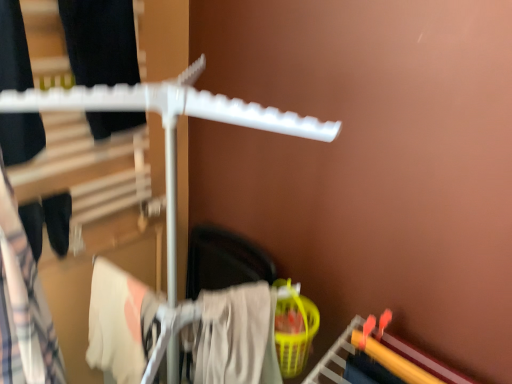
You are a GUI agent. You are given a task and a screenshot of the screen. Output one action in this format:
    pyautogui.click(x=<x>, y=<y>)
    Task: Click on the matte black pants at left, which ranks as the first clothing in left-to-right order
    The height and width of the screenshot is (384, 512).
    Given the screenshot: What is the action you would take?
    pyautogui.click(x=23, y=305)

Which object is further away from the camera taking this photo, white cotton towel at lower left, arranged as the second clothing when viewed from the left, or matte black pants at left, which ranks as the first clothing in left-to-right order?

white cotton towel at lower left, arranged as the second clothing when viewed from the left, is more distant.

Is point (90, 347) farther from camera compared to point (19, 279)?

Yes, it is.

In terms of height, does white cotton towel at lower left, arranged as the second clothing when viewed from the left, look taller or shorter compared to matte black pants at left, which ranks as the first clothing in left-to-right order?

white cotton towel at lower left, arranged as the second clothing when viewed from the left, is shorter than matte black pants at left, which ranks as the first clothing in left-to-right order.

Measure the distance from white cotton towel at lower left, which appears as the 2th clothing when viewed from the right, to matte black pants at left, which ranks as the first clothing in left-to-right order.

white cotton towel at lower left, which appears as the 2th clothing when viewed from the right, is 8.90 inches away from matte black pants at left, which ranks as the first clothing in left-to-right order.

How different are the orientations of beige cotton towel at lower center, placed as the third clothing when sorted from left to right, and matte black pants at left, which ranks as the first clothing in left-to-right order, in degrees?

There is a 1.28-degree angle between the facing directions of beige cotton towel at lower center, placed as the third clothing when sorted from left to right, and matte black pants at left, which ranks as the first clothing in left-to-right order.

Is beige cotton towel at lower center, the 1th clothing viewed from the right, far away from matte black pants at left, which ranks as the first clothing in left-to-right order?

No, beige cotton towel at lower center, the 1th clothing viewed from the right, is in close proximity to matte black pants at left, which ranks as the first clothing in left-to-right order.

From a real-world perspective, who is located lower, beige cotton towel at lower center, placed as the third clothing when sorted from left to right, or matte black pants at left, which ranks as the first clothing in left-to-right order?

beige cotton towel at lower center, placed as the third clothing when sorted from left to right.

Does beige cotton towel at lower center, the 1th clothing viewed from the right, have a larger size compared to matte black pants at left, which ranks as the first clothing in left-to-right order?

Indeed, beige cotton towel at lower center, the 1th clothing viewed from the right, has a larger size compared to matte black pants at left, which ranks as the first clothing in left-to-right order.

Considering the relative sizes of beige cotton towel at lower center, the 1th clothing viewed from the right, and white cotton towel at lower left, arranged as the second clothing when viewed from the left, in the image provided, is beige cotton towel at lower center, the 1th clothing viewed from the right, shorter than white cotton towel at lower left, arranged as the second clothing when viewed from the left,?

Result: Incorrect, the height of beige cotton towel at lower center, the 1th clothing viewed from the right, does not fall short of that of white cotton towel at lower left, arranged as the second clothing when viewed from the left.

Would you consider beige cotton towel at lower center, the 1th clothing viewed from the right, to be distant from white cotton towel at lower left, arranged as the second clothing when viewed from the left?

No.

From a real-world perspective, is beige cotton towel at lower center, placed as the third clothing when sorted from left to right, physically located above or below white cotton towel at lower left, which appears as the 2th clothing when viewed from the right?

In terms of real-world spatial position, beige cotton towel at lower center, placed as the third clothing when sorted from left to right, is below white cotton towel at lower left, which appears as the 2th clothing when viewed from the right.

Is point (233, 337) closer to viewer compared to point (143, 303)?

No, it is not.

Looking at this image, how different are the orientations of matte black pants at left, which ranks as the first clothing in left-to-right order, and beige cotton towel at lower center, placed as the third clothing when sorted from left to right, in degrees?

matte black pants at left, which ranks as the first clothing in left-to-right order, and beige cotton towel at lower center, placed as the third clothing when sorted from left to right, are facing 1.28 degrees away from each other.

From a real-world perspective, does matte black pants at left, which ranks as the first clothing in left-to-right order, stand above beige cotton towel at lower center, the 1th clothing viewed from the right?

Yes, from a real-world perspective, matte black pants at left, which ranks as the first clothing in left-to-right order, is over beige cotton towel at lower center, the 1th clothing viewed from the right

Could you measure the distance between matte black pants at left, arranged as the 3th clothing when viewed from the right, and beige cotton towel at lower center, the 1th clothing viewed from the right?

The distance of matte black pants at left, arranged as the 3th clothing when viewed from the right, from beige cotton towel at lower center, the 1th clothing viewed from the right, is 14.46 inches.

Considering the relative sizes of matte black pants at left, arranged as the 3th clothing when viewed from the right, and beige cotton towel at lower center, the 1th clothing viewed from the right, in the image provided, is matte black pants at left, arranged as the 3th clothing when viewed from the right, shorter than beige cotton towel at lower center, the 1th clothing viewed from the right,?

Incorrect, the height of matte black pants at left, arranged as the 3th clothing when viewed from the right, does not fall short of that of beige cotton towel at lower center, the 1th clothing viewed from the right.

Can you confirm if white cotton towel at lower left, arranged as the second clothing when viewed from the left, is wider than beige cotton towel at lower center, placed as the third clothing when sorted from left to right?

Indeed, white cotton towel at lower left, arranged as the second clothing when viewed from the left, has a greater width compared to beige cotton towel at lower center, placed as the third clothing when sorted from left to right.

From the image's perspective, would you say white cotton towel at lower left, which appears as the 2th clothing when viewed from the right, is positioned over beige cotton towel at lower center, the 1th clothing viewed from the right?

Yes, from the image's perspective, white cotton towel at lower left, which appears as the 2th clothing when viewed from the right, is over beige cotton towel at lower center, the 1th clothing viewed from the right.

How different are the orientations of white cotton towel at lower left, which appears as the 2th clothing when viewed from the right, and beige cotton towel at lower center, placed as the third clothing when sorted from left to right, in degrees?

The angle between the facing direction of white cotton towel at lower left, which appears as the 2th clothing when viewed from the right, and the facing direction of beige cotton towel at lower center, placed as the third clothing when sorted from left to right, is 0.000195 degrees.

From a real-world perspective, which object stands above the other?

In real-world perspective, white cotton towel at lower left, arranged as the second clothing when viewed from the left, is above.

From the image's perspective, is matte black pants at left, arranged as the 3th clothing when viewed from the right, beneath white cotton towel at lower left, arranged as the second clothing when viewed from the left?

Actually, matte black pants at left, arranged as the 3th clothing when viewed from the right, appears above white cotton towel at lower left, arranged as the second clothing when viewed from the left, in the image.

Is white cotton towel at lower left, arranged as the second clothing when viewed from the left, at the back of matte black pants at left, which ranks as the first clothing in left-to-right order?

No, matte black pants at left, which ranks as the first clothing in left-to-right order, is not facing the opposite direction of white cotton towel at lower left, arranged as the second clothing when viewed from the left.

Can you confirm if matte black pants at left, arranged as the 3th clothing when viewed from the right, is taller than white cotton towel at lower left, which appears as the 2th clothing when viewed from the right?

Indeed, matte black pants at left, arranged as the 3th clothing when viewed from the right, has a greater height compared to white cotton towel at lower left, which appears as the 2th clothing when viewed from the right.

Considering the positions of points (51, 356) and (152, 315), is point (51, 356) closer to camera compared to point (152, 315)?

Yes, it is in front of point (152, 315).

This screenshot has width=512, height=384. I want to click on clothing lying above the white cotton towel at lower left, which appears as the 2th clothing when viewed from the right (from the image's perspective), so click(23, 305).

This screenshot has width=512, height=384. I want to click on clothing that appears in front of the beige cotton towel at lower center, placed as the third clothing when sorted from left to right, so click(23, 305).

From the image, which object appears to be nearer to white cotton towel at lower left, arranged as the second clothing when viewed from the left, beige cotton towel at lower center, placed as the third clothing when sorted from left to right, or matte black pants at left, arranged as the 3th clothing when viewed from the right?

beige cotton towel at lower center, placed as the third clothing when sorted from left to right.

Looking at the image, which one is located further to white cotton towel at lower left, arranged as the second clothing when viewed from the left, matte black pants at left, which ranks as the first clothing in left-to-right order, or beige cotton towel at lower center, the 1th clothing viewed from the right?

matte black pants at left, which ranks as the first clothing in left-to-right order, lies further to white cotton towel at lower left, arranged as the second clothing when viewed from the left, than the other object.

Estimate the real-world distances between objects in this image. Which object is closer to matte black pants at left, arranged as the 3th clothing when viewed from the right, white cotton towel at lower left, arranged as the second clothing when viewed from the left, or beige cotton towel at lower center, the 1th clothing viewed from the right?

white cotton towel at lower left, arranged as the second clothing when viewed from the left, is positioned closer to the anchor matte black pants at left, arranged as the 3th clothing when viewed from the right.

When comparing their distances from beige cotton towel at lower center, placed as the third clothing when sorted from left to right, does white cotton towel at lower left, arranged as the second clothing when viewed from the left, or matte black pants at left, arranged as the 3th clothing when viewed from the right, seem closer?

The object closer to beige cotton towel at lower center, placed as the third clothing when sorted from left to right, is white cotton towel at lower left, arranged as the second clothing when viewed from the left.

Considering their positions, is beige cotton towel at lower center, placed as the third clothing when sorted from left to right, positioned further to matte black pants at left, arranged as the 3th clothing when viewed from the right, than white cotton towel at lower left, arranged as the second clothing when viewed from the left?

beige cotton towel at lower center, placed as the third clothing when sorted from left to right, is positioned further to the anchor matte black pants at left, arranged as the 3th clothing when viewed from the right.

Estimate the real-world distances between objects in this image. Which object is closer to beige cotton towel at lower center, placed as the third clothing when sorted from left to right, matte black pants at left, which ranks as the first clothing in left-to-right order, or white cotton towel at lower left, which appears as the 2th clothing when viewed from the right?

white cotton towel at lower left, which appears as the 2th clothing when viewed from the right, lies closer to beige cotton towel at lower center, placed as the third clothing when sorted from left to right, than the other object.

This screenshot has height=384, width=512. In order to click on clothing between matte black pants at left, arranged as the 3th clothing when viewed from the right, and beige cotton towel at lower center, the 1th clothing viewed from the right, from left to right in this screenshot , I will do `click(120, 323)`.